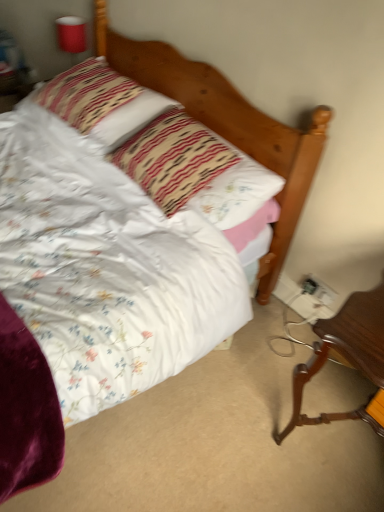
What do you see at coordinates (318, 289) in the screenshot?
I see `white plastic electric outlet at lower right, the 1th electric outlet from the right` at bounding box center [318, 289].

In order to face white plastic electric outlet at lower right, the 1th electric outlet from the right, should I rotate leftwards or rightwards?

Turn right approximately 16.689 degrees to face it.

This screenshot has width=384, height=512. Describe the element at coordinates (101, 102) in the screenshot. I see `striped fabric pillow at upper left, which is counted as the 1th pillow, starting from the back` at that location.

How much space does floral fabric pillow at center, positioned as the second pillow in back-to-front order, occupy vertically?

It is 11.44 inches.

In order to face brown polished wood desk at lower right, should I rotate leftwards or rightwards?

Rotate your view right by about 24.764°.

The width and height of the screenshot is (384, 512). In order to click on white plastic electrical outlet at lower right, arranged as the first electric outlet when viewed from the left in this screenshot , I will do `click(309, 285)`.

The image size is (384, 512). I want to click on red plastic cup at upper left, so click(x=71, y=35).

Which of these two, brown polished wood desk at lower right or floral fabric pillow at center, the first pillow positioned from the front, is wider?

Wider between the two is brown polished wood desk at lower right.

You are a GUI agent. You are given a task and a screenshot of the screen. Output one action in this format:
    pyautogui.click(x=<x>, y=<y>)
    Task: Click on the 1st pillow behind the brown polished wood desk at lower right
    This screenshot has height=512, width=384.
    Given the screenshot: What is the action you would take?
    pyautogui.click(x=195, y=170)

From the picture: Does brown polished wood desk at lower right turn towards floral fabric pillow at center, the first pillow positioned from the front?

No, brown polished wood desk at lower right is not aimed at floral fabric pillow at center, the first pillow positioned from the front.

From a real-world perspective, is brown polished wood desk at lower right positioned under floral fabric pillow at center, positioned as the second pillow in back-to-front order, based on gravity?

Indeed, from a real-world perspective, brown polished wood desk at lower right is positioned beneath floral fabric pillow at center, positioned as the second pillow in back-to-front order.

In terms of height, does white plastic electric outlet at lower right, which is counted as the second electric outlet, starting from the left, look taller or shorter compared to red plastic cup at upper left?

In the image, white plastic electric outlet at lower right, which is counted as the second electric outlet, starting from the left, appears to be shorter than red plastic cup at upper left.

From the image's perspective, which is above, white plastic electric outlet at lower right, which is counted as the second electric outlet, starting from the left, or red plastic cup at upper left?

red plastic cup at upper left appears higher in the image.

Identify the location of lamp lying behind the white plastic electric outlet at lower right, the 1th electric outlet from the right. (71, 35).

Does point (310, 290) come closer to viewer compared to point (75, 38)?

Yes, it is in front of point (75, 38).

Which is closer to the camera, (303, 292) or (138, 158)?

The point (138, 158) is in front.

Is white plastic electrical outlet at lower right, which is the second electric outlet in right-to-left order, far away from floral fabric pillow at center, positioned as the second pillow in back-to-front order?

Actually, white plastic electrical outlet at lower right, which is the second electric outlet in right-to-left order, and floral fabric pillow at center, positioned as the second pillow in back-to-front order, are a little close together.

Is white plastic electrical outlet at lower right, which is the second electric outlet in right-to-left order, wider than floral fabric pillow at center, positioned as the second pillow in back-to-front order?

No.

Is white plastic electrical outlet at lower right, which is the second electric outlet in right-to-left order, smaller than floral fabric pillow at center, the first pillow positioned from the front?

Yes.

In terms of size, does floral fabric pillow at center, positioned as the second pillow in back-to-front order, appear bigger or smaller than white plastic electric outlet at lower right, the 1th electric outlet from the right?

A: In the image, floral fabric pillow at center, positioned as the second pillow in back-to-front order, appears to be larger than white plastic electric outlet at lower right, the 1th electric outlet from the right.

From the image's perspective, is floral fabric pillow at center, the first pillow positioned from the front, over white plastic electric outlet at lower right, which is counted as the second electric outlet, starting from the left?

Indeed, from the image's perspective, floral fabric pillow at center, the first pillow positioned from the front, is shown above white plastic electric outlet at lower right, which is counted as the second electric outlet, starting from the left.

Is floral fabric pillow at center, the first pillow positioned from the front, positioned with its back to white plastic electric outlet at lower right, the 1th electric outlet from the right?

No, floral fabric pillow at center, the first pillow positioned from the front, is not facing the opposite direction of white plastic electric outlet at lower right, the 1th electric outlet from the right.

Is floral fabric pillow at center, the first pillow positioned from the front, smaller than brown polished wood desk at lower right?

Yes, floral fabric pillow at center, the first pillow positioned from the front, is smaller than brown polished wood desk at lower right.

Is floral fabric pillow at center, the first pillow positioned from the front, positioned before brown polished wood desk at lower right?

No.

Would you consider floral fabric pillow at center, positioned as the second pillow in back-to-front order, to be distant from brown polished wood desk at lower right?

Actually, floral fabric pillow at center, positioned as the second pillow in back-to-front order, and brown polished wood desk at lower right are a little close together.

Can you confirm if white plastic electrical outlet at lower right, which is the second electric outlet in right-to-left order, is positioned to the left of brown polished wood desk at lower right?

Yes.

How many degrees apart are the facing directions of white plastic electrical outlet at lower right, which is the second electric outlet in right-to-left order, and brown polished wood desk at lower right?

0.000542 degrees.

Based on the photo, are white plastic electrical outlet at lower right, arranged as the first electric outlet when viewed from the left, and brown polished wood desk at lower right making contact?

No, white plastic electrical outlet at lower right, arranged as the first electric outlet when viewed from the left, is not touching brown polished wood desk at lower right.

Is white plastic electrical outlet at lower right, which is the second electric outlet in right-to-left order, positioned behind brown polished wood desk at lower right?

Yes, the depth of white plastic electrical outlet at lower right, which is the second electric outlet in right-to-left order, is greater than that of brown polished wood desk at lower right.

In the scene shown: Can you tell me how much red plastic cup at upper left and floral fabric pillow at center, the first pillow positioned from the front, differ in facing direction?

The angular difference between red plastic cup at upper left and floral fabric pillow at center, the first pillow positioned from the front, is 0.74 degrees.

What are the coordinates of `lamp on the left of floral fabric pillow at center, positioned as the second pillow in back-to-front order` in the screenshot? It's located at (71, 35).

In terms of height, does red plastic cup at upper left look taller or shorter compared to floral fabric pillow at center, positioned as the second pillow in back-to-front order?

red plastic cup at upper left is taller than floral fabric pillow at center, positioned as the second pillow in back-to-front order.

From the image's perspective, between red plastic cup at upper left and floral fabric pillow at center, the first pillow positioned from the front, which one is located above?

red plastic cup at upper left is shown above in the image.

Which pillow is the 1st one when counting from the left side of the brown polished wood desk at lower right? Please provide its 2D coordinates.

[(195, 170)]

This screenshot has width=384, height=512. I want to click on the 2nd electric outlet to the right when counting from the red plastic cup at upper left, so click(318, 289).

Estimate the real-world distances between objects in this image. Which object is closer to brown polished wood desk at lower right, white plastic electrical outlet at lower right, which is the second electric outlet in right-to-left order, or white plastic electric outlet at lower right, the 1th electric outlet from the right?

The object closer to brown polished wood desk at lower right is white plastic electric outlet at lower right, the 1th electric outlet from the right.

From the picture: Considering their positions, is floral fabric pillow at center, the first pillow positioned from the front, positioned closer to brown polished wood desk at lower right than white plastic electrical outlet at lower right, which is the second electric outlet in right-to-left order?

white plastic electrical outlet at lower right, which is the second electric outlet in right-to-left order.

From the image, which object appears to be nearer to white plastic electrical outlet at lower right, which is the second electric outlet in right-to-left order, white plastic electric outlet at lower right, the 1th electric outlet from the right, or striped fabric pillow at upper left, acting as the second pillow starting from the front?

The object closer to white plastic electrical outlet at lower right, which is the second electric outlet in right-to-left order, is white plastic electric outlet at lower right, the 1th electric outlet from the right.

Looking at the image, which one is located closer to brown polished wood desk at lower right, red plastic cup at upper left or white plastic electric outlet at lower right, the 1th electric outlet from the right?

white plastic electric outlet at lower right, the 1th electric outlet from the right, is closer to brown polished wood desk at lower right.

Looking at the image, which one is located closer to red plastic cup at upper left, striped fabric pillow at upper left, acting as the second pillow starting from the front, or white plastic electrical outlet at lower right, which is the second electric outlet in right-to-left order?

striped fabric pillow at upper left, acting as the second pillow starting from the front, lies closer to red plastic cup at upper left than the other object.

Considering their positions, is red plastic cup at upper left positioned closer to striped fabric pillow at upper left, which is counted as the 1th pillow, starting from the back, than floral fabric pillow at center, the first pillow positioned from the front?

floral fabric pillow at center, the first pillow positioned from the front, lies closer to striped fabric pillow at upper left, which is counted as the 1th pillow, starting from the back, than the other object.

Considering their positions, is white plastic electric outlet at lower right, the 1th electric outlet from the right, positioned closer to floral fabric pillow at center, the first pillow positioned from the front, than white plastic electrical outlet at lower right, arranged as the first electric outlet when viewed from the left?

white plastic electric outlet at lower right, the 1th electric outlet from the right, lies closer to floral fabric pillow at center, the first pillow positioned from the front, than the other object.

Looking at the image, which one is located closer to white plastic electrical outlet at lower right, which is the second electric outlet in right-to-left order, floral fabric pillow at center, the first pillow positioned from the front, or white plastic electric outlet at lower right, which is counted as the second electric outlet, starting from the left?

The object closer to white plastic electrical outlet at lower right, which is the second electric outlet in right-to-left order, is white plastic electric outlet at lower right, which is counted as the second electric outlet, starting from the left.

Where is `pillow situated between striped fabric pillow at upper left, acting as the second pillow starting from the front, and white plastic electrical outlet at lower right, arranged as the first electric outlet when viewed from the left, from left to right`? pillow situated between striped fabric pillow at upper left, acting as the second pillow starting from the front, and white plastic electrical outlet at lower right, arranged as the first electric outlet when viewed from the left, from left to right is located at coordinates (195, 170).

The height and width of the screenshot is (512, 384). In order to click on electric outlet between floral fabric pillow at center, the first pillow positioned from the front, and white plastic electric outlet at lower right, which is counted as the second electric outlet, starting from the left, in the horizontal direction in this screenshot , I will do `click(309, 285)`.

You are a GUI agent. You are given a task and a screenshot of the screen. Output one action in this format:
    pyautogui.click(x=<x>, y=<y>)
    Task: Click on the electric outlet between brown polished wood desk at lower right and white plastic electrical outlet at lower right, arranged as the first electric outlet when viewed from the left, along the z-axis
    This screenshot has height=512, width=384.
    Given the screenshot: What is the action you would take?
    pyautogui.click(x=318, y=289)

You are a GUI agent. You are given a task and a screenshot of the screen. Output one action in this format:
    pyautogui.click(x=<x>, y=<y>)
    Task: Click on the electric outlet between striped fabric pillow at upper left, acting as the second pillow starting from the front, and white plastic electric outlet at lower right, which is counted as the second electric outlet, starting from the left
    This screenshot has height=512, width=384.
    Given the screenshot: What is the action you would take?
    pyautogui.click(x=309, y=285)